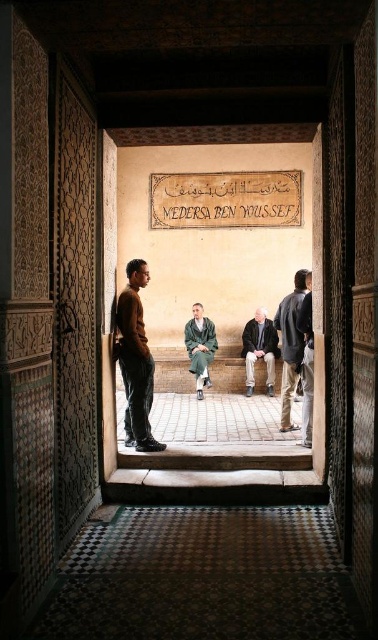
Can you confirm if dark gray fabric jacket at center is positioned to the right of dark blue fabric jacket at right?

No, dark gray fabric jacket at center is not to the right of dark blue fabric jacket at right.

Is dark gray fabric jacket at center taller than dark blue fabric jacket at right?

No.

Who is more forward, (243, 344) or (305, 436)?

Positioned in front is point (305, 436).

Find the location of a particular element. The height and width of the screenshot is (640, 378). dark gray fabric jacket at center is located at coordinates (260, 349).

From the picture: Is dark gray fabric jacket at right further to the viewer compared to dark gray fabric jacket at center?

That is False.

Is point (297, 360) closer to camera compared to point (271, 333)?

Yes.

What are the coordinates of `dark gray fabric jacket at right` in the screenshot? It's located at (291, 342).

Does carved wood door at left have a lesser width compared to dark gray fabric jacket at right?

Yes.

Is point (75, 356) closer to camera compared to point (288, 320)?

Yes, it is.

Does point (66, 435) come in front of point (294, 301)?

Yes, point (66, 435) is in front of point (294, 301).

You are a GUI agent. You are given a task and a screenshot of the screen. Output one action in this format:
    pyautogui.click(x=<x>, y=<y>)
    Task: Click on the carved wood door at left
    The height and width of the screenshot is (640, 378).
    Given the screenshot: What is the action you would take?
    pyautogui.click(x=74, y=300)